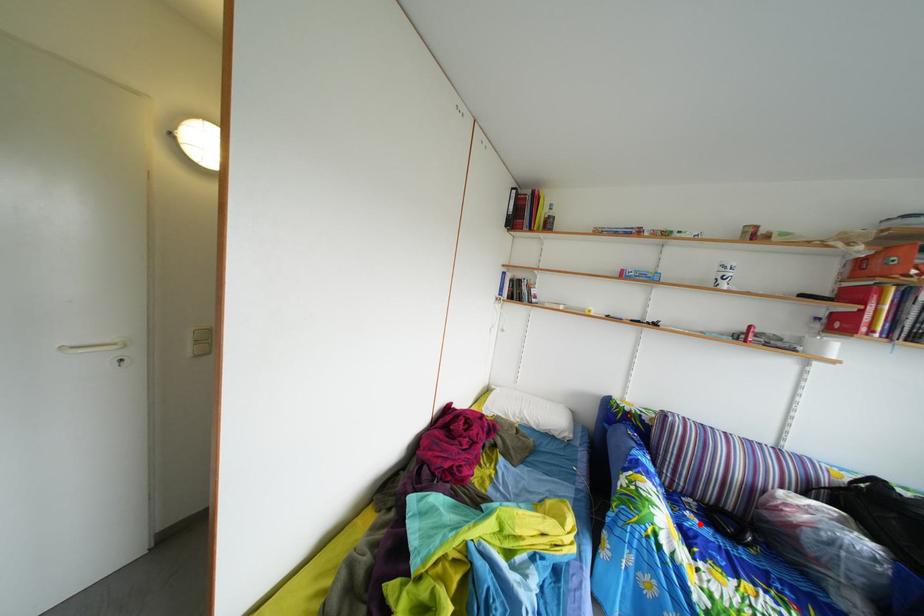
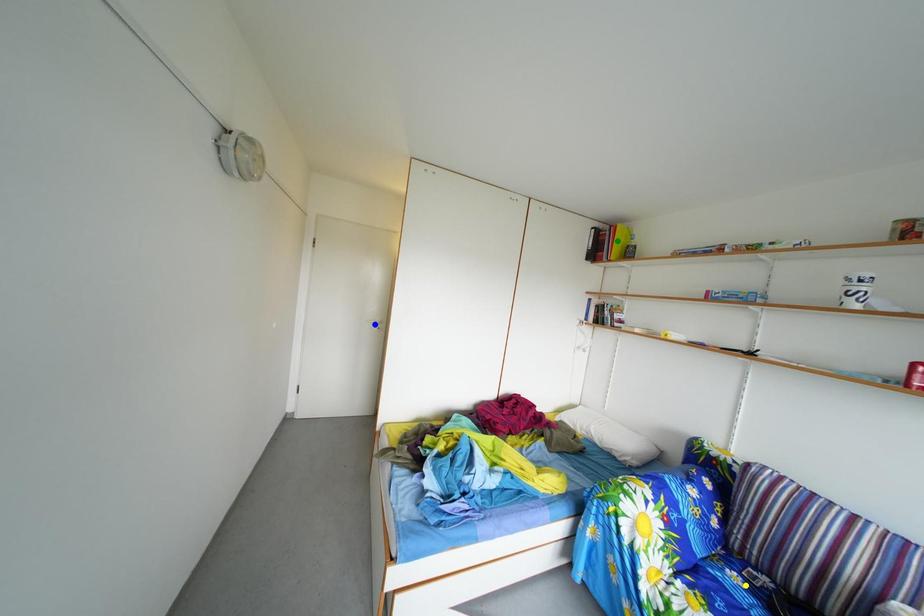
Question: I am providing you with two images of the same scene from different viewpoints. A red point is marked on the first image. You are given multiple points on the second image. Can you choose the point in image 2 that corresponds to the point in image 1?

Choices:
 (A) blue point
 (B) green point
 (C) yellow point

Answer: (C)